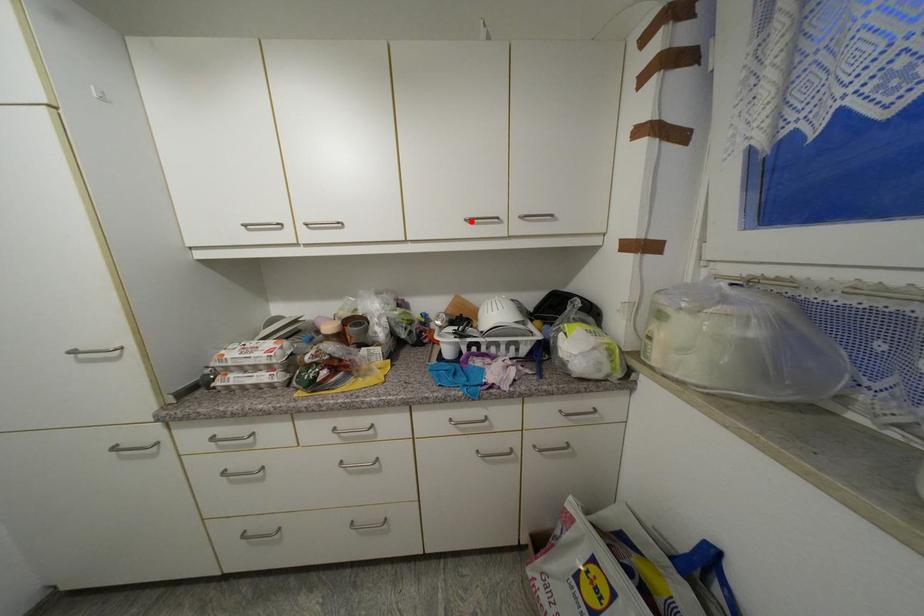
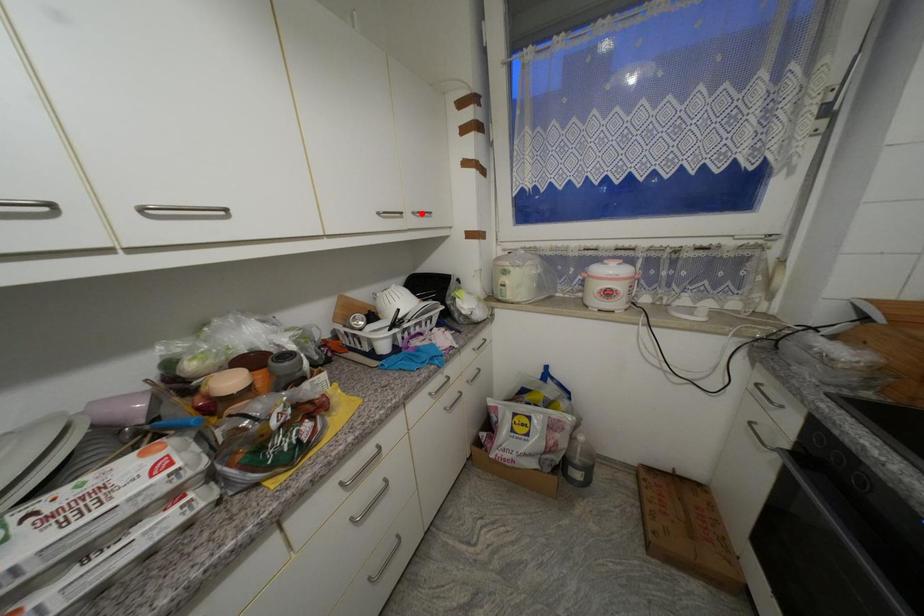
I am providing you with two images of the same scene from different viewpoints. A red point is marked on the first image and another point is marked on the second image. Are the points marked in image1 and image2 representing the same 3D position?

No